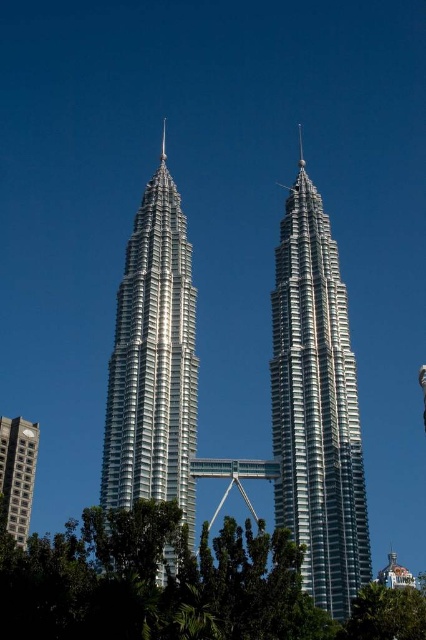
Does green leafy tree at center have a lesser height compared to green leafy tree at lower center?

No.

Can you confirm if green leafy tree at center is positioned above green leafy tree at lower center?

No, green leafy tree at center is not above green leafy tree at lower center.

Is point (285, 627) closer to camera compared to point (382, 627)?

Yes, point (285, 627) is closer to viewer.

I want to click on green leafy tree at center, so click(x=178, y=586).

From the picture: Who is more distant from viewer, (x=17, y=481) or (x=164, y=150)?

Point (x=164, y=150)

Does gray concrete building at lower left have a greater height compared to silver metallic spire at upper center?

Yes, gray concrete building at lower left is taller than silver metallic spire at upper center.

What do you see at coordinates (17, 472) in the screenshot? Image resolution: width=426 pixels, height=640 pixels. I see `gray concrete building at lower left` at bounding box center [17, 472].

Identify the location of gray concrete building at lower left. The image size is (426, 640). click(17, 472).

What do you see at coordinates (152, 362) in the screenshot?
I see `silver metallic tower at center` at bounding box center [152, 362].

Who is more forward, (190, 419) or (14, 512)?

Point (190, 419) is in front.

Between point (108, 420) and point (34, 477), which one is positioned in front?

Point (108, 420) is in front.

At what (x,y) coordinates should I click in order to perform the action: click on silver metallic tower at center. Please return your answer as a coordinate pair (x, y). The width and height of the screenshot is (426, 640). Looking at the image, I should click on (152, 362).